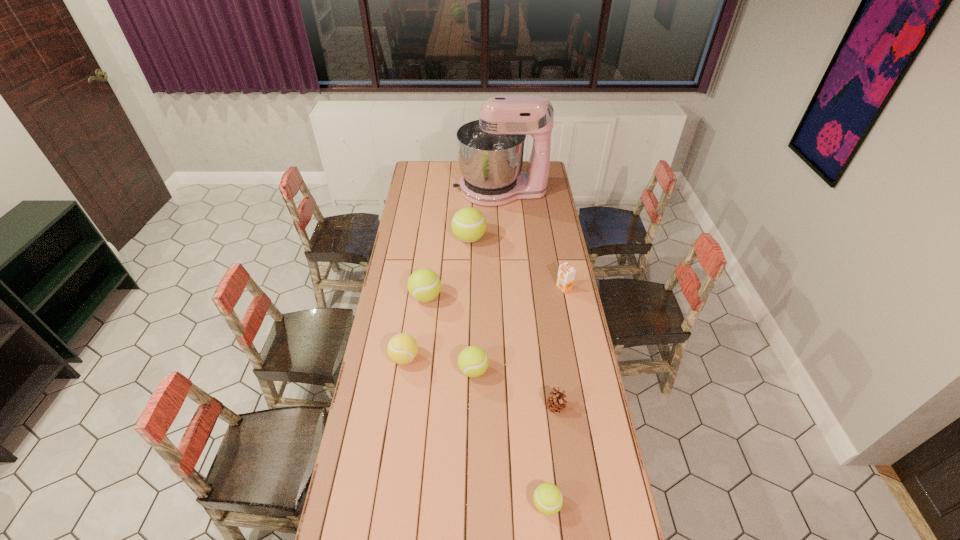
I want to click on vacant region located 0.080m on the front of the second nearest object, so click(560, 438).

The height and width of the screenshot is (540, 960). Find the location of `blank area located on the right of the nearest green tennis ball`. blank area located on the right of the nearest green tennis ball is located at coordinates [590, 504].

Where is `object present at the far edge`? object present at the far edge is located at coordinates [490, 150].

Locate an element on the screen. This screenshot has height=540, width=960. mixer located in the right edge section of the desktop is located at coordinates (490, 150).

Image resolution: width=960 pixels, height=540 pixels. I want to click on orange juice located in the right edge section of the desktop, so click(566, 273).

This screenshot has height=540, width=960. Identify the location of pinecone that is at the right edge. (555, 402).

Locate an element on the screen. The height and width of the screenshot is (540, 960). object that is positioned at the far right corner is located at coordinates (490, 150).

This screenshot has width=960, height=540. In the image, there is a desktop. What are the coordinates of `free space at the left edge` in the screenshot? It's located at (375, 411).

This screenshot has height=540, width=960. Identify the location of free space at the right edge of the desktop. (528, 201).

Locate an element on the screen. Image resolution: width=960 pixels, height=540 pixels. empty location between the orange orange juice and the second tallest tennis ball is located at coordinates (494, 292).